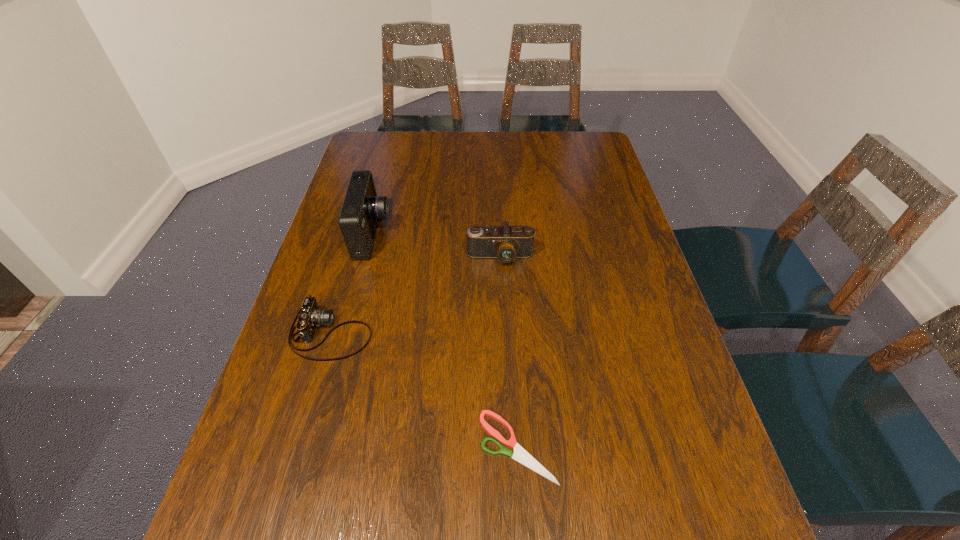
In order to click on empty location between the tallest object and the second tallest camera in this screenshot , I will do `click(436, 246)`.

At what (x,y) coordinates should I click in order to perform the action: click on vacant space that is in between the second tallest camera and the shortest camera. Please return your answer as a coordinate pair (x, y). The height and width of the screenshot is (540, 960). Looking at the image, I should click on point(416,295).

Where is `empty space that is in between the rightmost camera and the tallest camera`? This screenshot has height=540, width=960. empty space that is in between the rightmost camera and the tallest camera is located at coordinates (436, 246).

This screenshot has height=540, width=960. I want to click on unoccupied position between the second shortest camera and the tallest camera, so click(436, 246).

You are a GUI agent. You are given a task and a screenshot of the screen. Output one action in this format:
    pyautogui.click(x=<x>, y=<y>)
    Task: Click on the free space that is in between the second tallest camera and the tallest camera
    
    Given the screenshot: What is the action you would take?
    pyautogui.click(x=436, y=246)

Where is `object identified as the closest to the shortest object`? object identified as the closest to the shortest object is located at coordinates (309, 316).

Point out which object is positioned as the nearest to the rightmost camera. Please provide its 2D coordinates. Your answer should be formatted as a tuple, i.e. [(x, y)], where the tuple contains the x and y coordinates of a point satisfying the conditions above.

[(361, 209)]

Identify which camera is located as the nearest to the tallest camera. Please provide its 2D coordinates. Your answer should be formatted as a tuple, i.e. [(x, y)], where the tuple contains the x and y coordinates of a point satisfying the conditions above.

[(309, 316)]

Select which camera is the second closest to the nearest camera. Please provide its 2D coordinates. Your answer should be formatted as a tuple, i.e. [(x, y)], where the tuple contains the x and y coordinates of a point satisfying the conditions above.

[(506, 243)]

Find the location of a particular element. free space that satisfies the following two spatial constraints: 1. on the lens of the rightmost camera; 2. on the front-facing side of the nearest camera is located at coordinates (503, 333).